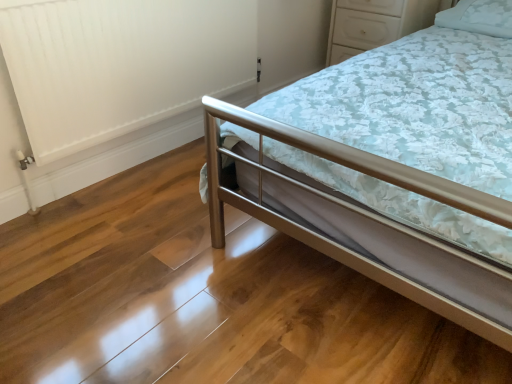
The image size is (512, 384). Describe the element at coordinates (479, 17) in the screenshot. I see `white fabric pillow at upper right` at that location.

Locate an element on the screen. white fabric pillow at upper right is located at coordinates (479, 17).

Describe the element at coordinates (120, 64) in the screenshot. The width and height of the screenshot is (512, 384). I see `white matte radiator at left` at that location.

What is the approximate height of white matte radiator at left?

white matte radiator at left is 30.71 inches tall.

Identify the location of white glossy dresser at upper right. This screenshot has width=512, height=384. (375, 23).

Locate an element on the screen. The width and height of the screenshot is (512, 384). white fabric pillow at upper right is located at coordinates (479, 17).

Which is more to the right, white glossy dresser at upper right or white fabric pillow at upper right?

white fabric pillow at upper right is more to the right.

Which object is wider, white glossy dresser at upper right or white fabric pillow at upper right?

With larger width is white glossy dresser at upper right.

Considering the sizes of objects white glossy dresser at upper right and white fabric pillow at upper right in the image provided, who is taller, white glossy dresser at upper right or white fabric pillow at upper right?

white glossy dresser at upper right is taller.

How different are the orientations of white glossy dresser at upper right and white fabric pillow at upper right in degrees?

They differ by 0.789 degrees in their facing directions.

Which object is positioned more to the right, metallic silver bed at center or white matte radiator at left?

From the viewer's perspective, metallic silver bed at center appears more on the right side.

Between metallic silver bed at center and white matte radiator at left, which one has smaller size?

Smaller between the two is white matte radiator at left.

From a real-world perspective, is metallic silver bed at center over white matte radiator at left?

Yes.

How different are the orientations of white matte radiator at left and white glossy dresser at upper right in degrees?

91.1 degrees.

Image resolution: width=512 pixels, height=384 pixels. In order to click on radiator on the left of white glossy dresser at upper right in this screenshot , I will do `click(120, 64)`.

Between white matte radiator at left and white glossy dresser at upper right, which one has larger width?

Wider between the two is white glossy dresser at upper right.

In the image, there is a white glossy dresser at upper right. In order to click on bed below it (from the image's perspective) in this screenshot , I will do `click(390, 170)`.

Considering the relative sizes of metallic silver bed at center and white glossy dresser at upper right in the image provided, is metallic silver bed at center taller than white glossy dresser at upper right?

Yes.

Is white glossy dresser at upper right a part of metallic silver bed at center?

That's incorrect, white glossy dresser at upper right is not inside metallic silver bed at center.

Based on the photo, is metallic silver bed at center not near white glossy dresser at upper right?

Yes.

Is white glossy dresser at upper right facing towards metallic silver bed at center?

No, white glossy dresser at upper right is not oriented towards metallic silver bed at center.

From a real-world perspective, is white glossy dresser at upper right positioned above or below metallic silver bed at center?

white glossy dresser at upper right is below metallic silver bed at center.

From the picture: Can you confirm if white glossy dresser at upper right is taller than metallic silver bed at center?

Incorrect, the height of white glossy dresser at upper right is not larger of that of metallic silver bed at center.

I want to click on dresser behind the metallic silver bed at center, so [375, 23].

Considering the sizes of objects metallic silver bed at center and white fabric pillow at upper right in the image provided, who is shorter, metallic silver bed at center or white fabric pillow at upper right?

white fabric pillow at upper right is shorter.

Is metallic silver bed at center to the right of white fabric pillow at upper right from the viewer's perspective?

No.

The image size is (512, 384). In order to click on bed that appears on the left of white fabric pillow at upper right in this screenshot , I will do `click(390, 170)`.

Would you say white matte radiator at left is a long distance from metallic silver bed at center?

Answer: white matte radiator at left is actually quite close to metallic silver bed at center.

Is point (147, 24) positioned after point (329, 122)?

Yes, it is.

From the image's perspective, is white matte radiator at left above or below metallic silver bed at center?

From the image's perspective, white matte radiator at left appears above metallic silver bed at center.

Between white matte radiator at left and metallic silver bed at center, which one is positioned in front?

metallic silver bed at center.

The image size is (512, 384). What are the coordinates of `dresser behind the white fabric pillow at upper right` in the screenshot? It's located at (375, 23).

This screenshot has height=384, width=512. In order to click on bed on the right of white matte radiator at left in this screenshot , I will do `click(390, 170)`.

Estimate the real-world distances between objects in this image. Which object is further from white fabric pillow at upper right, metallic silver bed at center or white matte radiator at left?

white matte radiator at left lies further to white fabric pillow at upper right than the other object.

When comparing their distances from metallic silver bed at center, does white matte radiator at left or white glossy dresser at upper right seem further?

white glossy dresser at upper right is positioned further to the anchor metallic silver bed at center.

Looking at the image, which one is located closer to white matte radiator at left, white glossy dresser at upper right or white fabric pillow at upper right?

white glossy dresser at upper right.

When comparing their distances from white matte radiator at left, does metallic silver bed at center or white glossy dresser at upper right seem further?

white glossy dresser at upper right.

From the image, which object appears to be nearer to white glossy dresser at upper right, white fabric pillow at upper right or white matte radiator at left?

white fabric pillow at upper right is closer to white glossy dresser at upper right.

From the image, which object appears to be farther from white glossy dresser at upper right, white matte radiator at left or metallic silver bed at center?

The object further to white glossy dresser at upper right is metallic silver bed at center.

When comparing their distances from metallic silver bed at center, does white glossy dresser at upper right or white matte radiator at left seem closer?

Among the two, white matte radiator at left is located nearer to metallic silver bed at center.

Estimate the real-world distances between objects in this image. Which object is closer to white fabric pillow at upper right, white glossy dresser at upper right or white matte radiator at left?

white glossy dresser at upper right lies closer to white fabric pillow at upper right than the other object.

Find the location of a particular element. pillow positioned between metallic silver bed at center and white glossy dresser at upper right from near to far is located at coordinates (479, 17).

At what (x,y) coordinates should I click in order to perform the action: click on bed situated between white matte radiator at left and white fabric pillow at upper right from left to right. Please return your answer as a coordinate pair (x, y). The image size is (512, 384). Looking at the image, I should click on (390, 170).

The image size is (512, 384). I want to click on radiator between metallic silver bed at center and white glossy dresser at upper right in the front-back direction, so click(x=120, y=64).

Where is `dresser located between white matte radiator at left and white fabric pillow at upper right in the left-right direction`? dresser located between white matte radiator at left and white fabric pillow at upper right in the left-right direction is located at coordinates (375, 23).